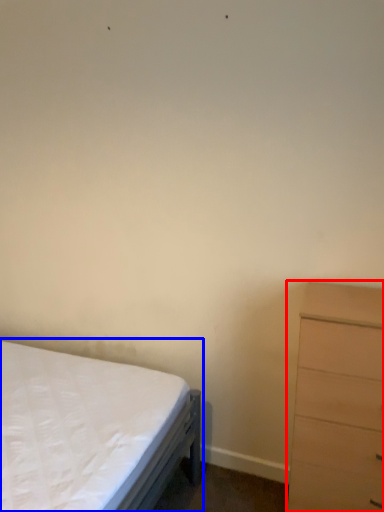
Question: Which object is closer to the camera taking this photo, chest of drawers (highlighted by a red box) or bed (highlighted by a blue box)?

Choices:
 (A) chest of drawers
 (B) bed

Answer: (B)